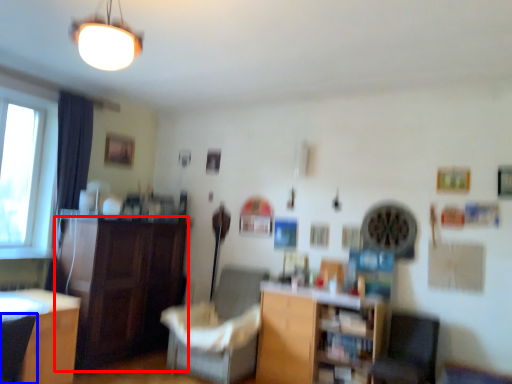
Question: Which object appears farthest to the camera in this image, cabinetry (highlighted by a red box) or armchair (highlighted by a blue box)?

Choices:
 (A) cabinetry
 (B) armchair

Answer: (A)